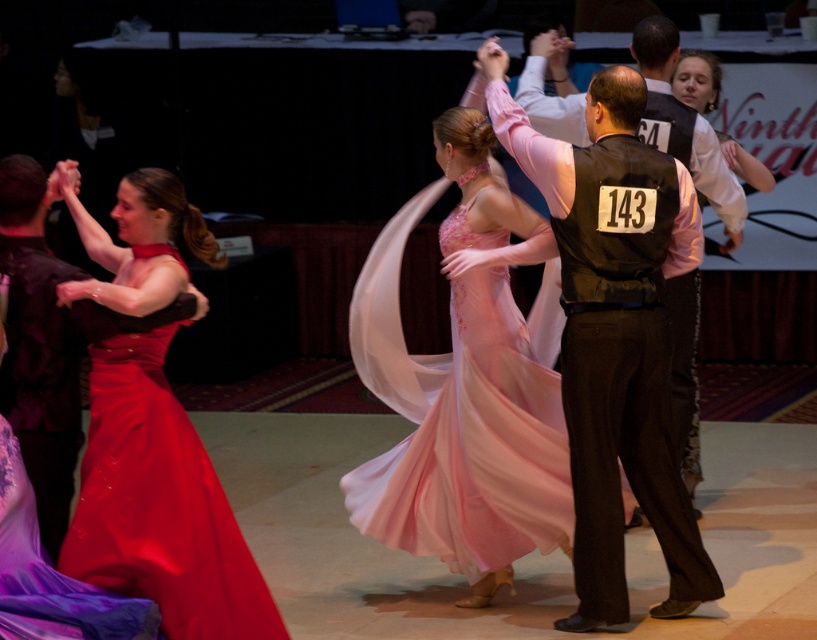
Question: Which of the following is the closest to the observer?

Choices:
 (A) (39, 556)
 (B) (663, 84)
 (C) (444, 518)

Answer: (A)

Question: Which of the following is the farthest from the observer?

Choices:
 (A) satin dress at left
 (B) pink satin dress at center

Answer: (B)

Question: Which object is the farthest from the shiny satin dress at lower left?

Choices:
 (A) black satin vest at center
 (B) matte black dress at left
 (C) pink satin dress at center
 (D) satin dress at left

Answer: (A)

Question: Does satin dress at left have a larger size compared to black satin vest at center?

Choices:
 (A) no
 (B) yes

Answer: (B)

Question: Does pink satin dress at center have a smaller size compared to black satin vest at center?

Choices:
 (A) no
 (B) yes

Answer: (A)

Question: Can you confirm if matte black dress at left is smaller than black satin vest at center?

Choices:
 (A) yes
 (B) no

Answer: (A)